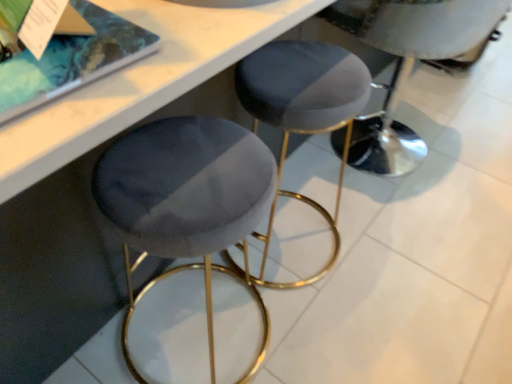
Question: Looking at the image, does velvet grey stool at center seem bigger or smaller compared to velvet grey stool at center?

Choices:
 (A) small
 (B) big

Answer: (B)

Question: Considering their positions, is velvet grey stool at center located in front of or behind velvet grey stool at center?

Choices:
 (A) front
 (B) behind

Answer: (B)

Question: From their relative heights in the image, would you say velvet grey stool at center is taller or shorter than velvet grey stool at center?

Choices:
 (A) tall
 (B) short

Answer: (A)

Question: From a real-world perspective, is velvet grey stool at center above or below velvet grey stool at center?

Choices:
 (A) above
 (B) below

Answer: (B)

Question: Is velvet grey stool at center inside the boundaries of velvet grey stool at center, or outside?

Choices:
 (A) outside
 (B) inside

Answer: (A)

Question: From the image's perspective, is velvet grey stool at center above or below velvet grey stool at center?

Choices:
 (A) below
 (B) above

Answer: (A)

Question: Considering their positions, is velvet grey stool at center located in front of or behind velvet grey stool at center?

Choices:
 (A) front
 (B) behind

Answer: (A)